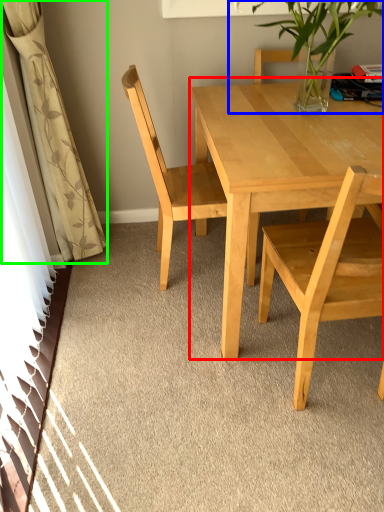
Question: Based on their relative distances, which object is nearer to coffee table (highlighted by a red box)? Choose from houseplant (highlighted by a blue box) and curtain (highlighted by a green box).

Choices:
 (A) houseplant
 (B) curtain

Answer: (A)